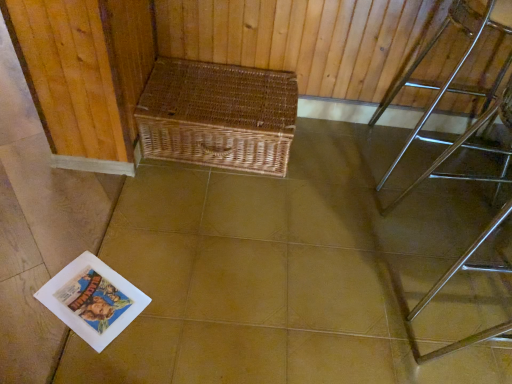
This screenshot has height=384, width=512. What are the coordinates of `vacant area that lies between polished chrome table at right and woven brown picnic basket at center` in the screenshot? It's located at (337, 157).